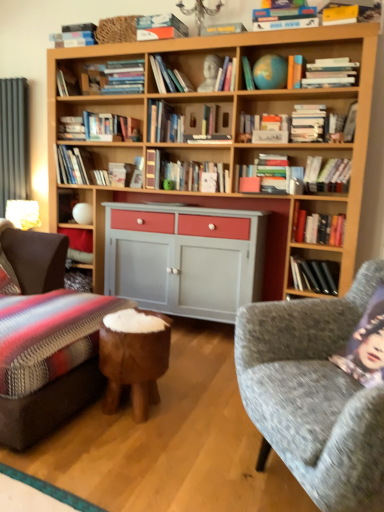
Question: From the image's perspective, is white matte magazine at center, the 2th magazine from the bottom, above or below white matte book at center, the sixth book from the left?

Choices:
 (A) above
 (B) below

Answer: (A)

Question: From a real-world perspective, is white matte magazine at center, the 2th magazine from the bottom, physically located above or below white matte book at center, which appears as the 3th book when ordered from the bottom?

Choices:
 (A) above
 (B) below

Answer: (A)

Question: Estimate the real-world distances between objects in this image. Which object is closer to the hardcover book at upper right, acting as the 3th magazine starting from the bottom?

Choices:
 (A) textured gray fabric couch at lower right
 (B) black hardcover books at center-right, which is counted as the first book, starting from the bottom
 (C) green matte globe at upper center, the second book in the top-to-bottom sequence
 (D) matte white book at upper center, which is counted as the 2th book, starting from the left
 (E) matte gold table lamp at left

Answer: (C)

Question: Based on their relative distances, which object is farther from the white matte book at center, which appears as the 1th book when viewed from the right?

Choices:
 (A) white matte magazine at center, the 2th magazine from the bottom
 (B) hardcover books at right, arranged as the 5th book when viewed from the top
 (C) textured gray fabric couch at lower right
 (D) yellow paper magazine at upper right, the fourth magazine from the bottom
 (E) polished wood stool at center

Answer: (E)